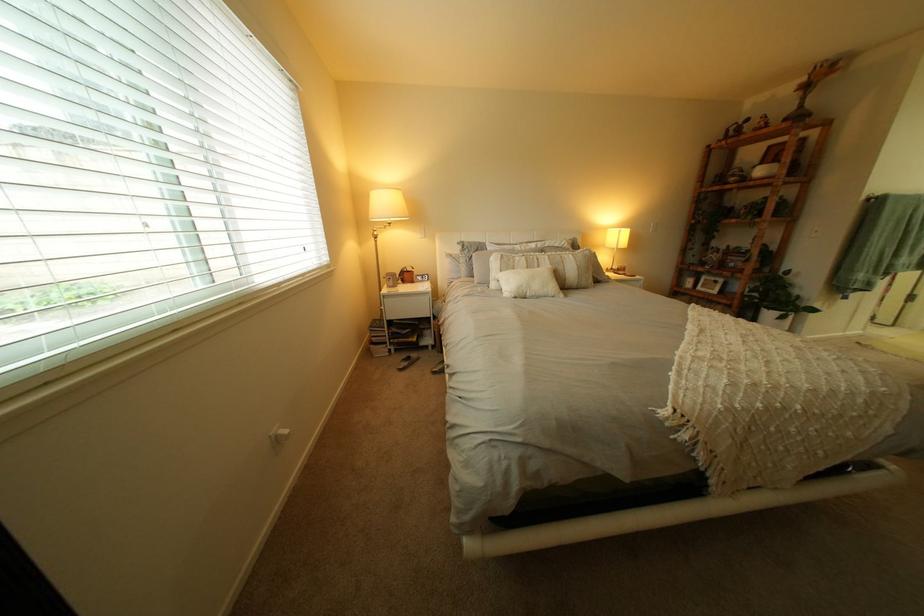
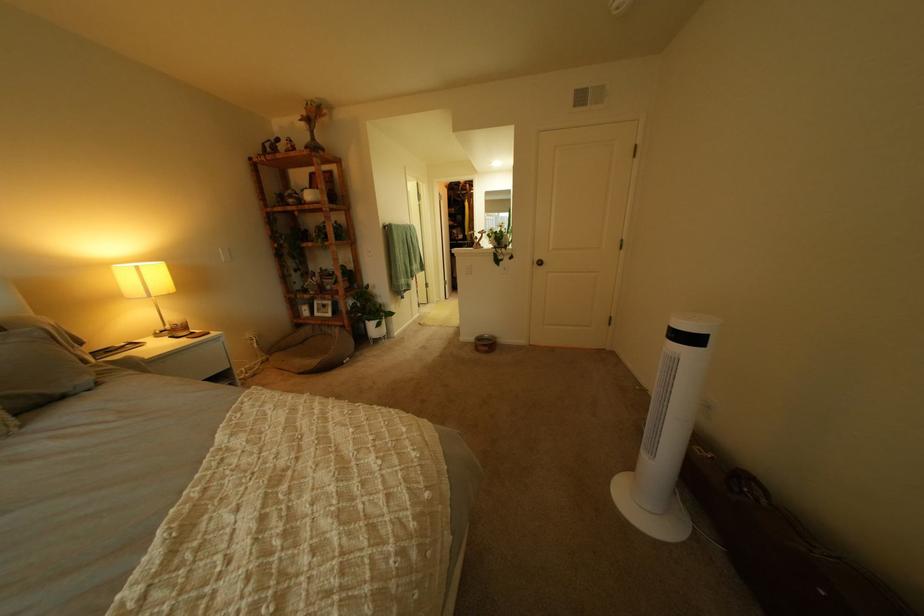
The point at [624,283] is marked in the first image. Where is the corresponding point in the second image?

(115, 385)